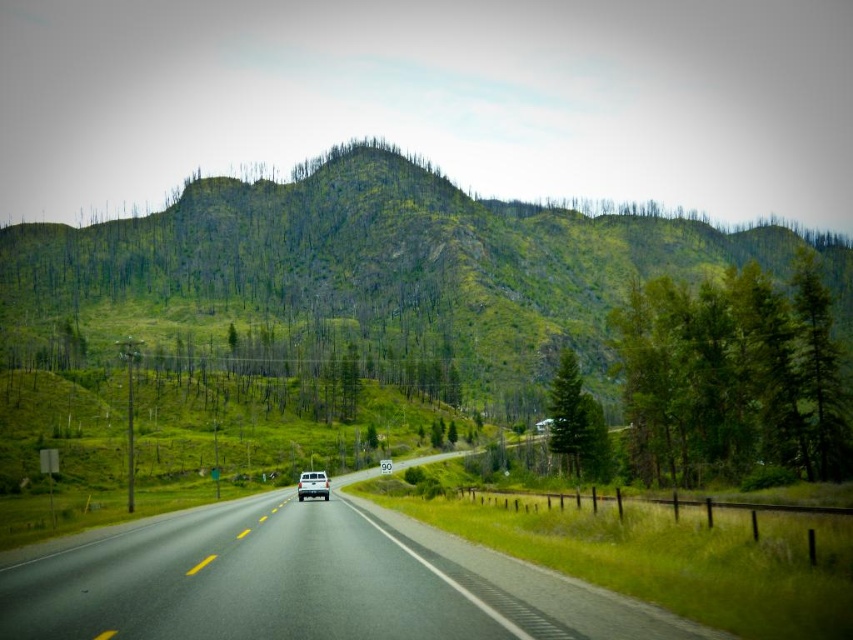
Measure the distance between point (573, 426) and camera.

A distance of 277.16 feet exists between point (573, 426) and camera.

Does green matte tree at right come behind white matte truck at center?

Yes, green matte tree at right is further from the viewer.

Measure the distance between green matte tree at right and camera.

green matte tree at right and camera are 78.35 meters apart from each other.

The width and height of the screenshot is (853, 640). I want to click on green matte tree at right, so click(577, 424).

Consider the image. Can you confirm if green textured hillside at upper center is wider than black asphalt road at center?

Indeed, green textured hillside at upper center has a greater width compared to black asphalt road at center.

Which is in front, point (485, 248) or point (79, 541)?

Point (79, 541) is in front.

What do you see at coordinates (374, 272) in the screenshot?
I see `green textured hillside at upper center` at bounding box center [374, 272].

Identify the location of green textured hillside at upper center. The width and height of the screenshot is (853, 640). (374, 272).

Looking at this image, is black asphalt road at center bigger than white matte truck at center?

Actually, black asphalt road at center might be smaller than white matte truck at center.

Who is more distant from viewer, (10, 611) or (322, 477)?

Positioned behind is point (322, 477).

This screenshot has height=640, width=853. What are the coordinates of `black asphalt road at center` in the screenshot? It's located at (303, 580).